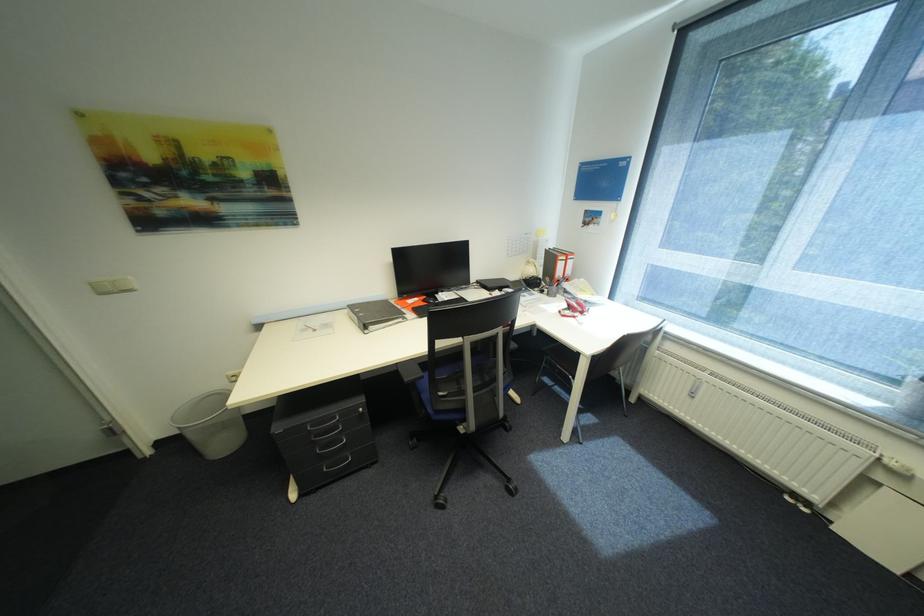
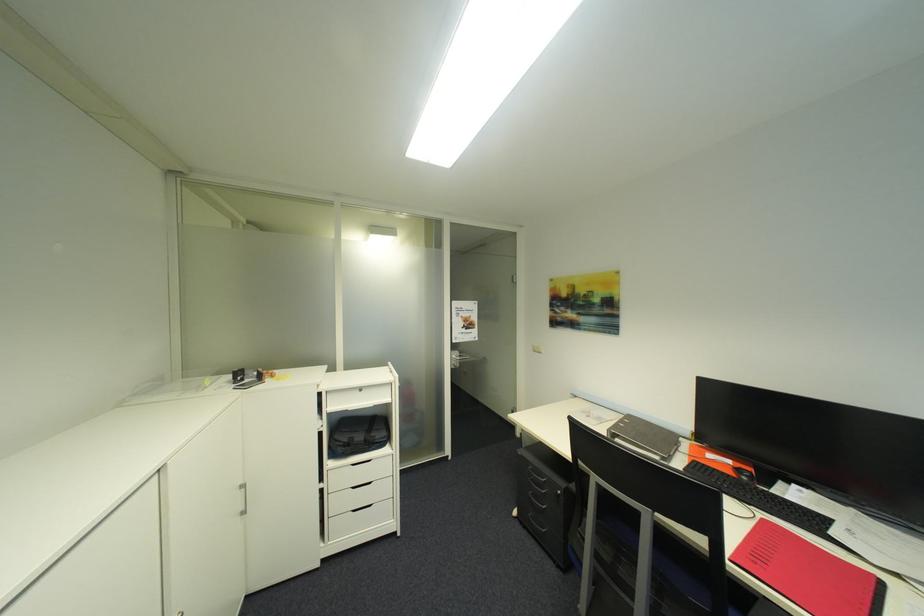
Where in the second image is the point corresponding to point 424,300 from the first image?

(736, 463)